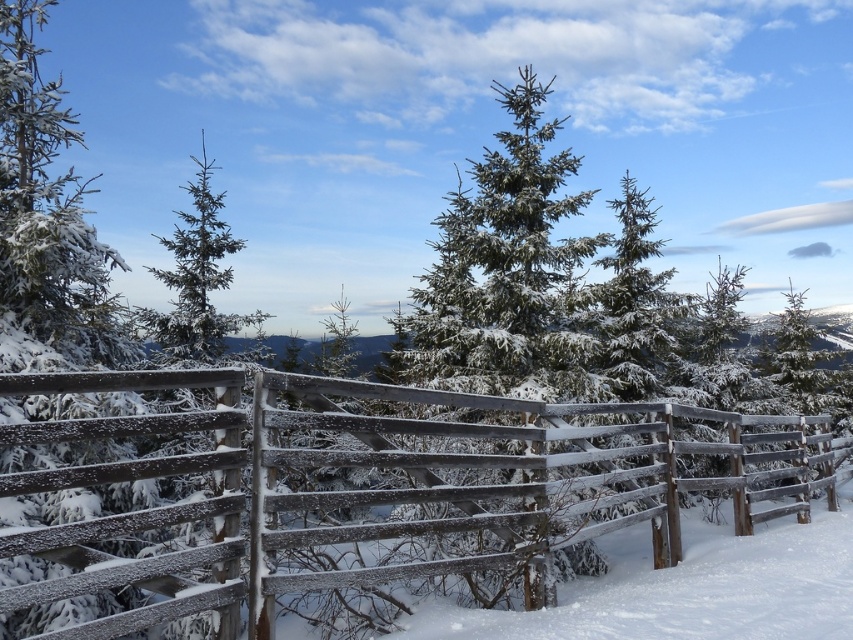
You are standing at the wooden fence in the snow scene and want to reach a point in the image. Which of the two points, point (274,563) or point (202,266), is closer to you?

Point (274,563) is closer to the camera than point (202,266).

You are standing in the winter scene and want to walk towards the green matte tree at upper left. Which direction should you move relative to the frosted wood fence at center?

You should move to the left side of the frosted wood fence at center to reach the green matte tree at upper left because the green matte tree at upper left is on the left side of the frosted wood fence at center.

You are an observer standing in the snow. You see the frosted wood fence at center and the green matte tree at upper left. Which object is smaller in size?

The frosted wood fence at center is smaller in size compared to the green matte tree at upper left.